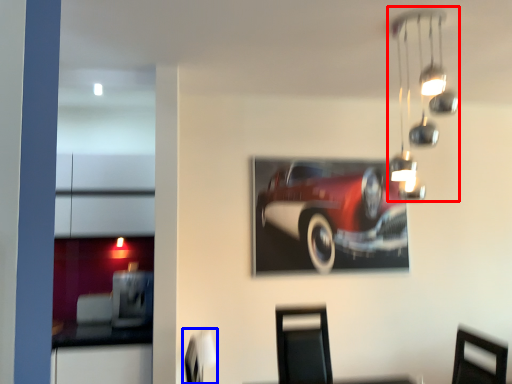
Question: Which point is closer to the camera, lamp (highlighted by a red box) or swivel chair (highlighted by a blue box)?

Choices:
 (A) lamp
 (B) swivel chair

Answer: (A)